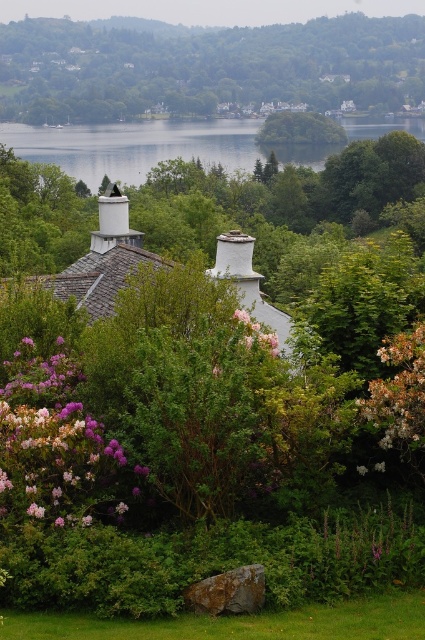
From the picture: You are a gardener who wants to plant a new flower that needs to be taller than the purple matte flower at lower left. Can you plant it where the clear water at center is currently located?

The clear water at center is taller than the purple matte flower at lower left. Since the new flower needs to be taller than the purple matte flower at lower left, planting it where the clear water at center is located would be suitable as the height requirement is met.

In the scene, there is a green leafy tree at center and a white matte chimney at upper center. From the perspective of an observer looking at the image, which object is positioned to the right of the other?

The green leafy tree at center is positioned to the right of the white matte chimney at upper center.